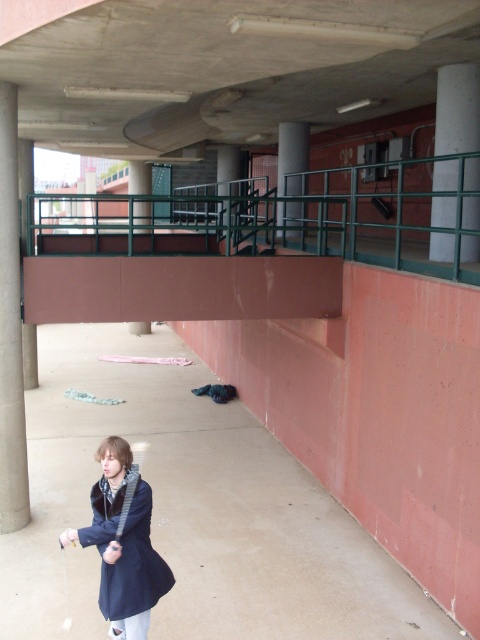
Can you confirm if concrete pillar at left is positioned to the left of concrete at right?

Correct, you'll find concrete pillar at left to the left of concrete at right.

Is point (2, 276) positioned after point (441, 122)?

No, (2, 276) is closer to viewer.

Is point (8, 417) farther from viewer compared to point (465, 179)?

No, (8, 417) is in front of (465, 179).

Find the location of a particular element. concrete pillar at left is located at coordinates (11, 328).

Is point (176, 605) closer to camera compared to point (228, 248)?

That is True.

Between concrete at lower center and concrete at center, which one is positioned higher?

concrete at center

Between point (356, 570) and point (238, 172), which one is positioned behind?

The point (238, 172) is more distant.

This screenshot has height=640, width=480. In order to click on concrete at lower center in this screenshot , I will do `click(192, 512)`.

Which is below, concrete pillar at left or concrete at center?

concrete pillar at left is lower down.

Does point (1, 516) lie behind point (226, 147)?

That is False.

Between point (0, 196) and point (233, 161), which one is positioned in front?

Point (0, 196) is more forward.

Where is `concrete pillar at left`? The height and width of the screenshot is (640, 480). concrete pillar at left is located at coordinates [11, 328].